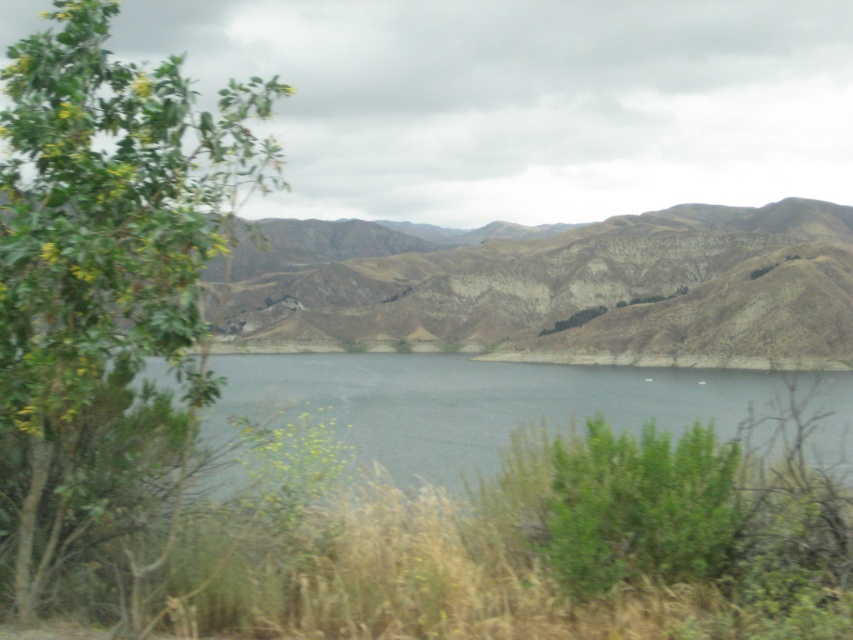
You are an environmental scientist studying elevation changes in the landscape. You observe the brown textured mountain at center and the clear water at center. Which of these two features has a higher elevation?

The brown textured mountain at center has a greater height compared to the clear water at center, so the brown textured mountain at center has a higher elevation.